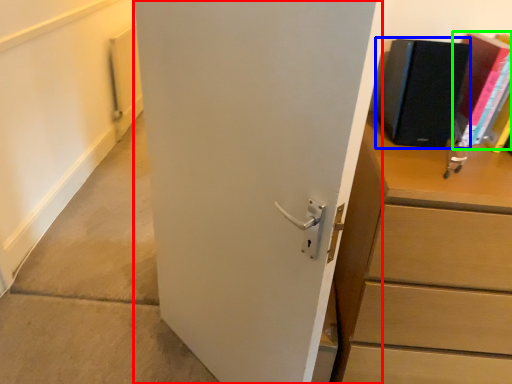
Question: Considering the real-world distances, which object is closest to door (highlighted by a red box)? paperback book (highlighted by a blue box) or paperback book (highlighted by a green box).

Choices:
 (A) paperback book
 (B) paperback book

Answer: (A)